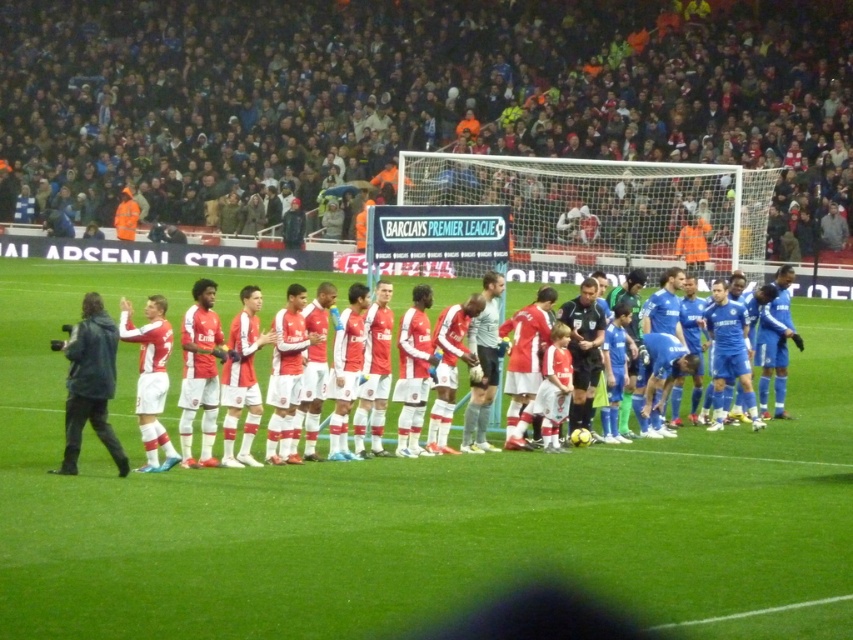
You are a photographer at the stadium and want to capture a photo of the matte red jersey at center without any obstruction from the dark gray jacket at left. Based on their positions, is this possible?

The dark gray jacket at left is behind the matte red jersey at center, so taking a photo from the front would allow you to capture the matte red jersey at center without obstruction from the dark gray jacket at left.

Consider the image. You are a photographer at the stadium and want to capture a photo of the matte red jersey at center and the dark gray jacket at left. If you want to ensure both are fully visible in the frame, which object should you adjust your focus to prioritize based on their sizes?

The matte red jersey at center is smaller in width than the dark gray jacket at left. To ensure both are fully visible, prioritize focusing on the larger dark gray jacket at left to maintain its detail while still capturing the smaller matte red jersey at center in the frame.